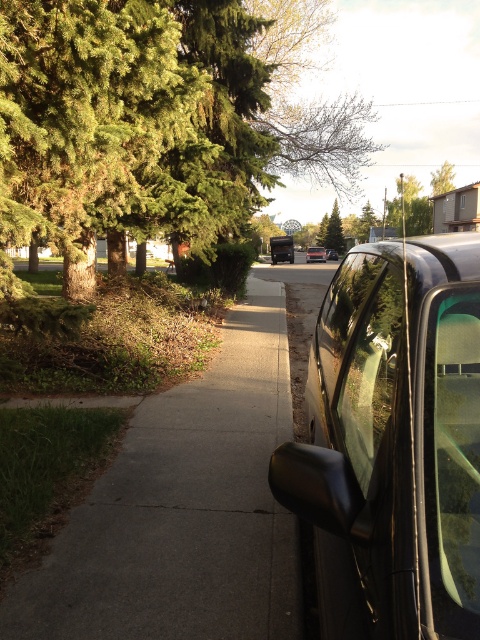
Question: Which point is farther from the camera taking this photo?

Choices:
 (A) (33, 198)
 (B) (436, 273)
 (C) (455, 387)

Answer: (A)

Question: Does gray concrete sidewalk at center come in front of satin black car at center?

Choices:
 (A) no
 (B) yes

Answer: (B)

Question: Where is gray concrete sidewalk at center located in relation to satin black sedan at center in the image?

Choices:
 (A) below
 (B) above

Answer: (A)

Question: Can you confirm if gray concrete sidewalk at center is smaller than satin black sedan at center?

Choices:
 (A) yes
 (B) no

Answer: (A)

Question: Which point appears closest to the camera in this image?

Choices:
 (A) (357, 433)
 (B) (326, 250)
 (C) (324, 244)
 (D) (52, 216)

Answer: (A)

Question: Which object appears closest to the camera in this image?

Choices:
 (A) satin black sedan at center
 (B) gray concrete sidewalk at center
 (C) transparent glass window at right
 (D) glossy black car at right

Answer: (C)